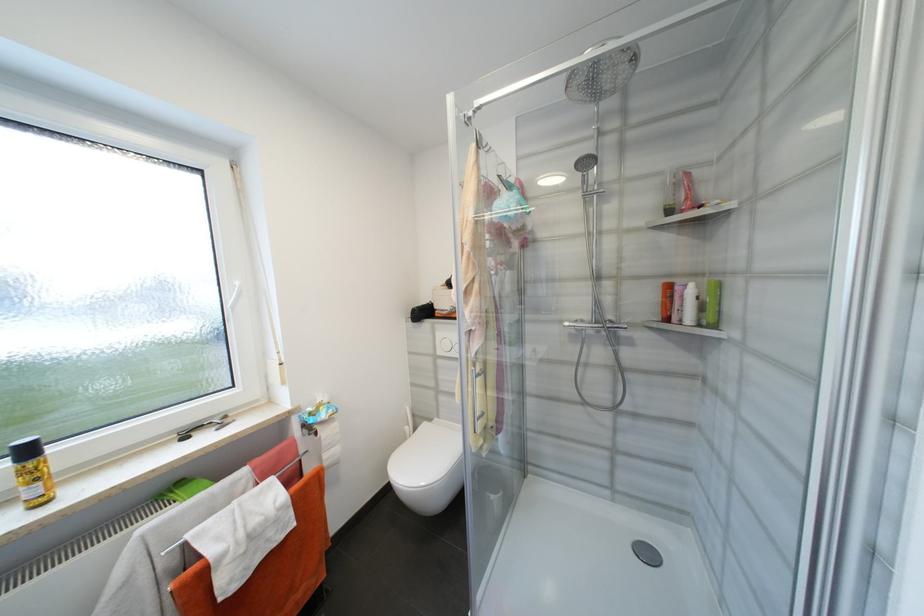
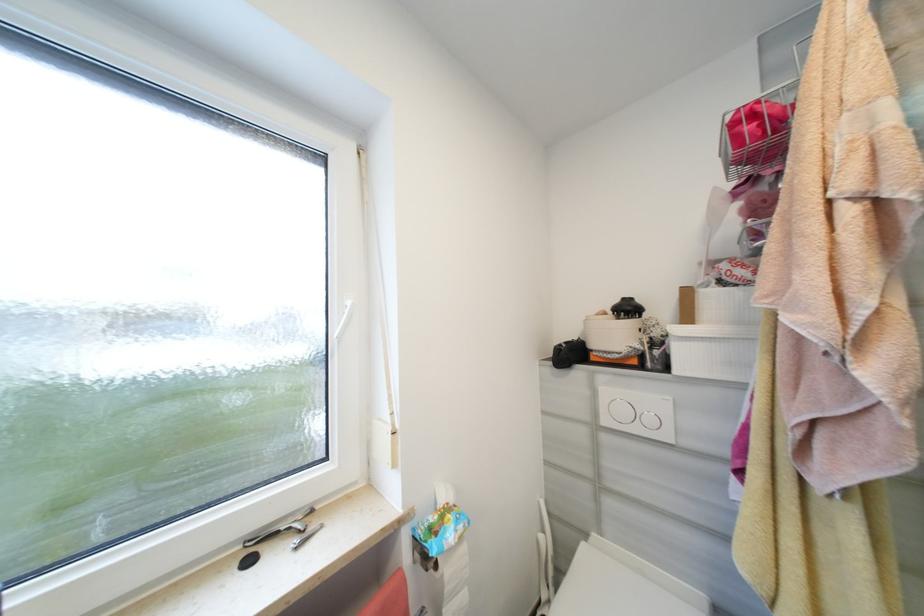
Question: The camera is either moving clockwise (left) or counter-clockwise (right) around the object. The first image is from the beginning of the video and the second image is from the end. Is the camera moving left or right when shooting the video?

Choices:
 (A) Left
 (B) Right

Answer: (B)